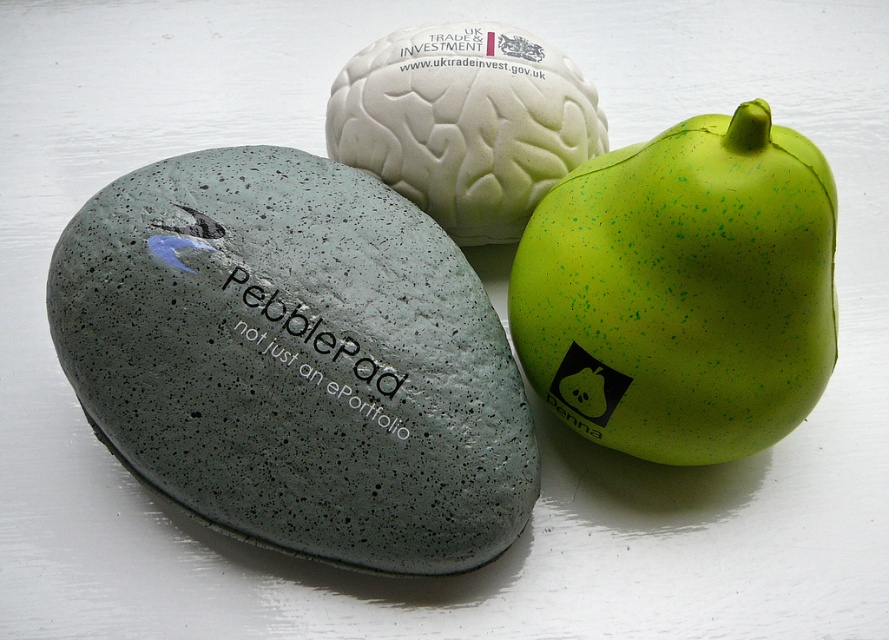
Question: Which object is positioned farthest from the green speckled rubber at center right?

Choices:
 (A) speckled gray stone at center-left
 (B) white matte brain at center

Answer: (A)

Question: Can you confirm if speckled gray stone at center-left is positioned below white matte brain at center?

Choices:
 (A) yes
 (B) no

Answer: (A)

Question: Does speckled gray stone at center-left have a smaller size compared to white matte brain at center?

Choices:
 (A) no
 (B) yes

Answer: (A)

Question: Is speckled gray stone at center-left behind white matte brain at center?

Choices:
 (A) yes
 (B) no

Answer: (B)

Question: Which point is closer to the camera taking this photo?

Choices:
 (A) (543, 177)
 (B) (697, 260)

Answer: (B)

Question: Among these objects, which one is nearest to the camera?

Choices:
 (A) green speckled rubber at center right
 (B) white matte brain at center
 (C) speckled gray stone at center-left

Answer: (A)